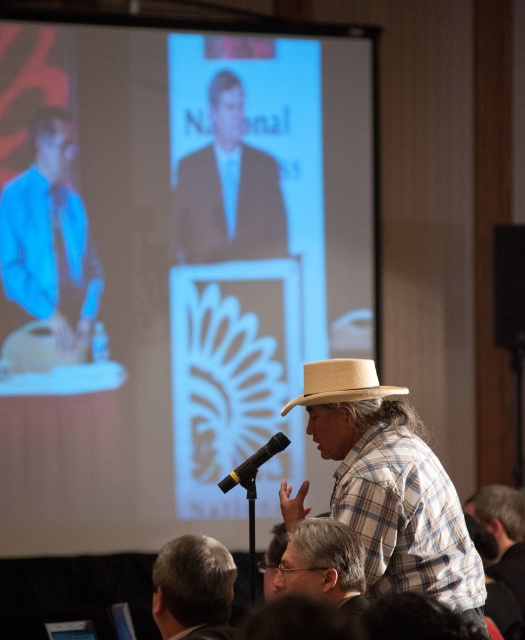
Question: Which object is closer to the camera taking this photo?

Choices:
 (A) black matte microphone at center
 (B) woven straw hat at center
 (C) plaid cotton shirt at center
 (D) gray hair at upper center

Answer: (C)

Question: Which object is positioned farthest from the clear plastic glasses at center?

Choices:
 (A) matte black suit at center
 (B) plaid cotton shirt at center
 (C) gray hair at upper center

Answer: (A)

Question: Does plaid cotton shirt at center have a smaller size compared to plaid shirt at center?

Choices:
 (A) yes
 (B) no

Answer: (B)

Question: From the image, what is the correct spatial relationship of white matte projection screen at upper center in relation to black matte microphone at center?

Choices:
 (A) above
 (B) below

Answer: (A)

Question: Is matte black suit at center below plaid shirt at center?

Choices:
 (A) yes
 (B) no

Answer: (B)

Question: Which of the following is the closest to the observer?

Choices:
 (A) black matte microphone at center
 (B) plaid cotton shirt at center
 (C) plaid shirt at center
 (D) matte black suit at center

Answer: (B)